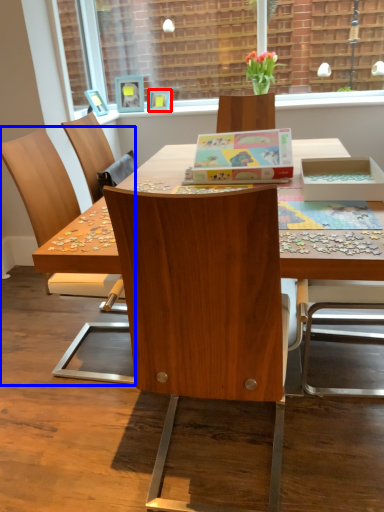
Question: Among these objects, which one is nearest to the camera, picture frame (highlighted by a red box) or chair (highlighted by a blue box)?

Choices:
 (A) picture frame
 (B) chair

Answer: (B)